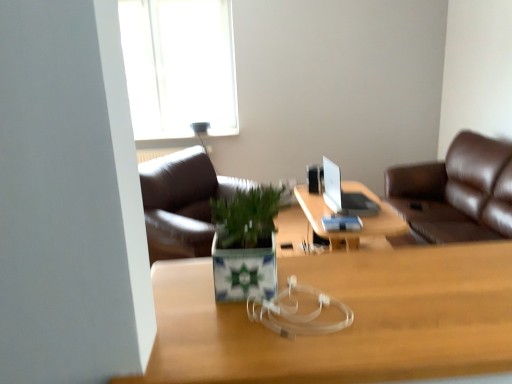
I want to click on free spot in front of green ceramic pot at center, so click(254, 338).